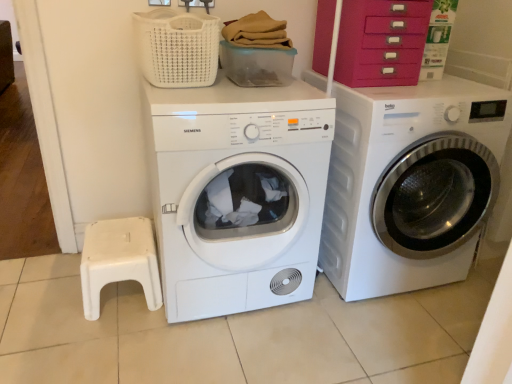
This screenshot has height=384, width=512. What are the coordinates of `free spot in front of white plastic step stool at lower left` in the screenshot? It's located at (97, 344).